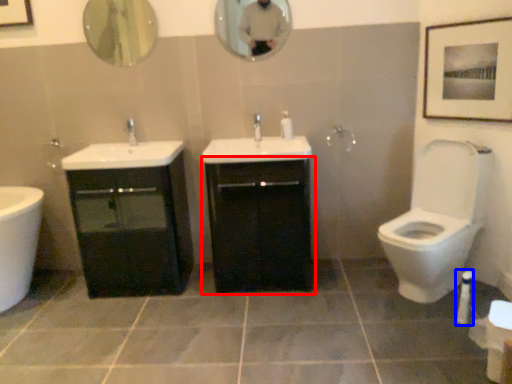
Question: Which object is closer to the camera taking this photo, bathroom cabinet (highlighted by a red box) or toiletry (highlighted by a blue box)?

Choices:
 (A) bathroom cabinet
 (B) toiletry

Answer: (B)